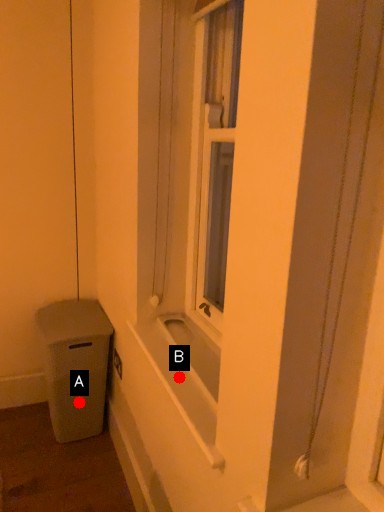
Question: Two points are circled on the image, labeled by A and B beside each circle. Among these points, which one is farthest from the camera?

Choices:
 (A) A is further
 (B) B is further

Answer: (A)